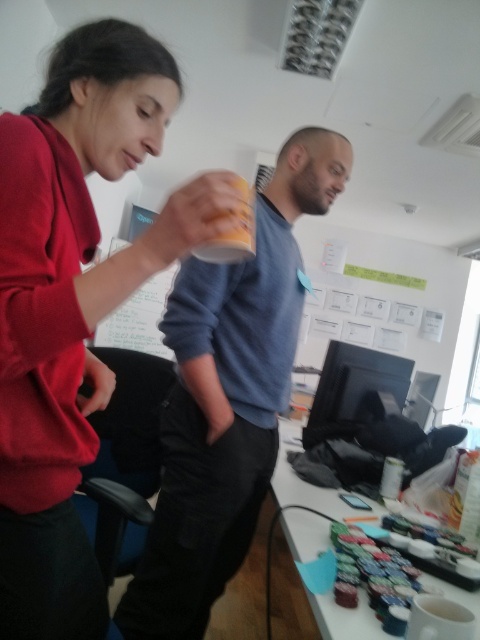
Question: Observing the image, what is the correct spatial positioning of matte red sweater at upper left in reference to blue cotton sweater at center?

Choices:
 (A) below
 (B) above

Answer: (B)

Question: Which object is positioned closest to the blue cotton sweater at center?

Choices:
 (A) matte red sweater at upper left
 (B) matte plastic cup at center
 (C) white glossy table at lower right

Answer: (A)

Question: Is matte red sweater at upper left to the left of matte plastic cup at center from the viewer's perspective?

Choices:
 (A) no
 (B) yes

Answer: (B)

Question: Which point is farther to the camera?

Choices:
 (A) (232, 253)
 (B) (218, 588)
 (C) (288, 531)

Answer: (B)

Question: Is blue cotton sweater at center to the left of matte plastic cup at center from the viewer's perspective?

Choices:
 (A) yes
 (B) no

Answer: (A)

Question: Which object is the farthest from the matte red sweater at upper left?

Choices:
 (A) blue cotton sweater at center
 (B) white glossy table at lower right
 (C) matte plastic cup at center

Answer: (B)